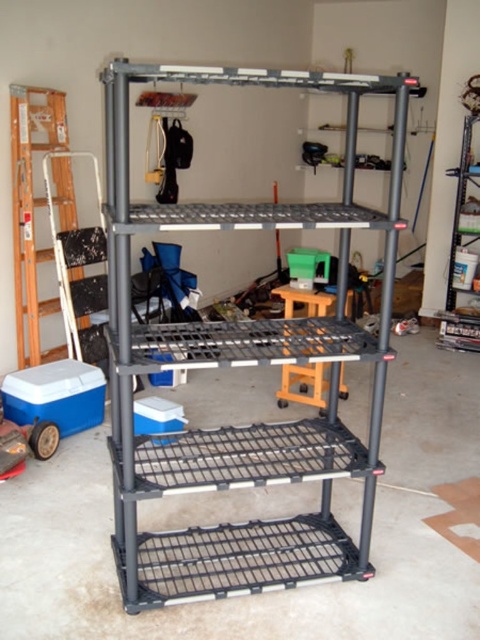
Question: Which of the following is the farthest from the observer?

Choices:
 (A) wooden ladder at left
 (B) wooden stool at center

Answer: (B)

Question: Does wooden ladder at left have a lesser width compared to wooden stool at center?

Choices:
 (A) no
 (B) yes

Answer: (B)

Question: Is wooden ladder at left to the right of wooden stool at center from the viewer's perspective?

Choices:
 (A) no
 (B) yes

Answer: (A)

Question: Which point appears farthest from the camera in this image?

Choices:
 (A) (20, 172)
 (B) (305, 388)

Answer: (B)

Question: Can you confirm if wooden ladder at left is positioned below wooden stool at center?

Choices:
 (A) yes
 (B) no

Answer: (B)